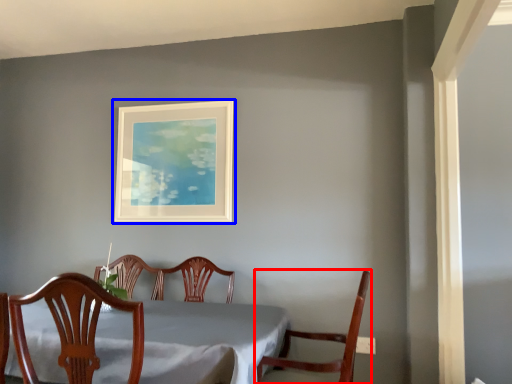
Question: Among these objects, which one is nearest to the camera, chair (highlighted by a red box) or picture frame (highlighted by a blue box)?

Choices:
 (A) chair
 (B) picture frame

Answer: (A)